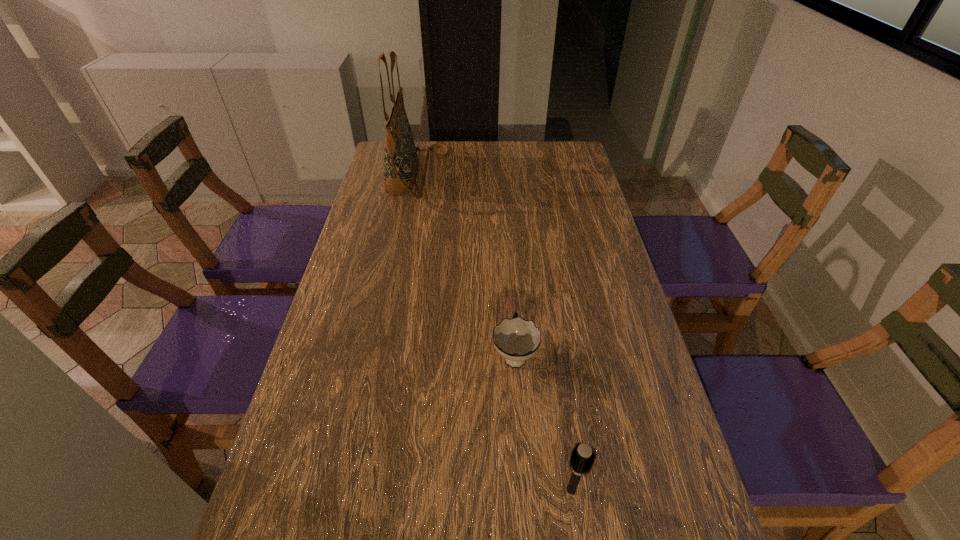
Identify the location of the leftmost object. The width and height of the screenshot is (960, 540). (401, 162).

Locate an element on the screen. Image resolution: width=960 pixels, height=540 pixels. the farthest object is located at coordinates (401, 162).

Where is `hairbrush`? hairbrush is located at coordinates (582, 458).

This screenshot has height=540, width=960. Identify the location of the nearest object. (582, 458).

Identify the location of the second object from left to right. (516, 339).

Where is `cup`? This screenshot has height=540, width=960. cup is located at coordinates (516, 339).

Where is `blank space located on the front-facing side of the handbag`? This screenshot has height=540, width=960. blank space located on the front-facing side of the handbag is located at coordinates tap(494, 174).

Where is `free space located 0.320m on the left of the hairbrush`? The image size is (960, 540). free space located 0.320m on the left of the hairbrush is located at coordinates (392, 489).

At what (x,y) coordinates should I click in order to perform the action: click on vacant space located on the side of the second object from right to left with the handle. Please return your answer as a coordinate pair (x, y). The width and height of the screenshot is (960, 540). Looking at the image, I should click on (510, 281).

The height and width of the screenshot is (540, 960). Identify the location of vacant point located on the side of the second object from right to left with the handle. (508, 260).